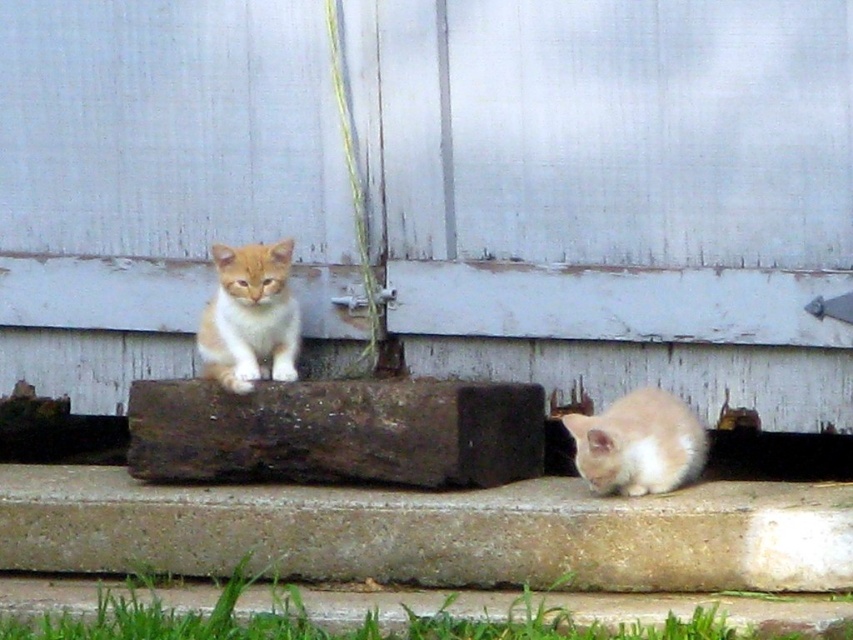
Does orange fur kitten at center have a lesser width compared to soft orange fur at lower right?

Yes, orange fur kitten at center is thinner than soft orange fur at lower right.

Who is positioned more to the left, orange fur kitten at center or soft orange fur at lower right?

orange fur kitten at center is more to the left.

Between point (257, 368) and point (666, 419), which one is positioned in front?

Point (666, 419) is in front.

Where is `orange fur kitten at center`? This screenshot has width=853, height=640. orange fur kitten at center is located at coordinates (248, 316).